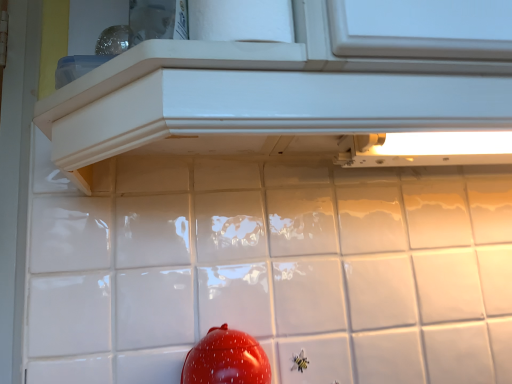
The image size is (512, 384). Describe the element at coordinates (271, 90) in the screenshot. I see `white glossy cabinet at upper center` at that location.

Where is `white glossy cabinet at upper center`? white glossy cabinet at upper center is located at coordinates (271, 90).

Describe the element at coordinates (226, 359) in the screenshot. I see `glossy red tomato at lower center` at that location.

The image size is (512, 384). I want to click on glossy red tomato at lower center, so click(x=226, y=359).

This screenshot has width=512, height=384. I want to click on white glossy cabinet at upper center, so click(x=271, y=90).

Is glossy red tomato at lower center to the right of white glossy cabinet at upper center from the viewer's perspective?

Correct, you'll find glossy red tomato at lower center to the right of white glossy cabinet at upper center.

Which object is closer to the camera taking this photo, glossy red tomato at lower center or white glossy cabinet at upper center?

Positioned in front is white glossy cabinet at upper center.

In the scene shown: Which is closer, (242, 382) or (341, 75)?

Clearly, point (242, 382) is more distant from the camera than point (341, 75).

From the image's perspective, which is above, glossy red tomato at lower center or white glossy cabinet at upper center?

white glossy cabinet at upper center appears higher in the image.

From a real-world perspective, is glossy red tomato at lower center above or below white glossy cabinet at upper center?

In terms of real-world spatial position, glossy red tomato at lower center is below white glossy cabinet at upper center.

Considering the sizes of objects glossy red tomato at lower center and white glossy cabinet at upper center in the image provided, who is thinner, glossy red tomato at lower center or white glossy cabinet at upper center?

glossy red tomato at lower center.

Does glossy red tomato at lower center have a lesser height compared to white glossy cabinet at upper center?

No, glossy red tomato at lower center is not shorter than white glossy cabinet at upper center.

Is glossy red tomato at lower center smaller than white glossy cabinet at upper center?

Yes, glossy red tomato at lower center is smaller than white glossy cabinet at upper center.

Is glossy red tomato at lower center completely or partially outside of white glossy cabinet at upper center?

Yes, glossy red tomato at lower center is not within white glossy cabinet at upper center.

Can you see glossy red tomato at lower center touching white glossy cabinet at upper center?

No, glossy red tomato at lower center is not beside white glossy cabinet at upper center.

Is white glossy cabinet at upper center at the back of glossy red tomato at lower center?

That's not correct — glossy red tomato at lower center is not looking away from white glossy cabinet at upper center.

What's the angular difference between glossy red tomato at lower center and white glossy cabinet at upper center's facing directions?

44.1 degrees.

Consider the image. How far apart are glossy red tomato at lower center and white glossy cabinet at upper center?

glossy red tomato at lower center is 12.32 inches away from white glossy cabinet at upper center.

The width and height of the screenshot is (512, 384). Identify the location of tomato behind the white glossy cabinet at upper center. (226, 359).

Which object is positioned more to the left, white glossy cabinet at upper center or glossy red tomato at lower center?

white glossy cabinet at upper center is more to the left.

Is the depth of white glossy cabinet at upper center greater than that of glossy red tomato at lower center?

No.

Does point (65, 109) come behind point (196, 372)?

No, (65, 109) is in front of (196, 372).

From the image's perspective, who appears lower, white glossy cabinet at upper center or glossy red tomato at lower center?

glossy red tomato at lower center appears lower in the image.

From a real-world perspective, is white glossy cabinet at upper center positioned above or below glossy red tomato at lower center?

From a real-world perspective, white glossy cabinet at upper center is physically above glossy red tomato at lower center.

Which object is wider, white glossy cabinet at upper center or glossy red tomato at lower center?

Wider between the two is white glossy cabinet at upper center.

Is white glossy cabinet at upper center taller or shorter than glossy red tomato at lower center?

white glossy cabinet at upper center is shorter than glossy red tomato at lower center.

Can you confirm if white glossy cabinet at upper center is bigger than glossy red tomato at lower center?

Yes.

Is white glossy cabinet at upper center positioned beyond the bounds of glossy red tomato at lower center?

white glossy cabinet at upper center lies outside glossy red tomato at lower center's area.

Is white glossy cabinet at upper center beside glossy red tomato at lower center?

white glossy cabinet at upper center and glossy red tomato at lower center are not in contact.

Does white glossy cabinet at upper center turn towards glossy red tomato at lower center?

No, white glossy cabinet at upper center is not turned towards glossy red tomato at lower center.

The width and height of the screenshot is (512, 384). What are the coordinates of `cabinetry that is above the glossy red tomato at lower center (from a real-world perspective)` in the screenshot? It's located at (271, 90).

This screenshot has width=512, height=384. Find the location of `cabinetry lying above the glossy red tomato at lower center (from the image's perspective)`. cabinetry lying above the glossy red tomato at lower center (from the image's perspective) is located at coordinates (271, 90).

This screenshot has width=512, height=384. What are the coordinates of `tomato behind the white glossy cabinet at upper center` in the screenshot? It's located at (226, 359).